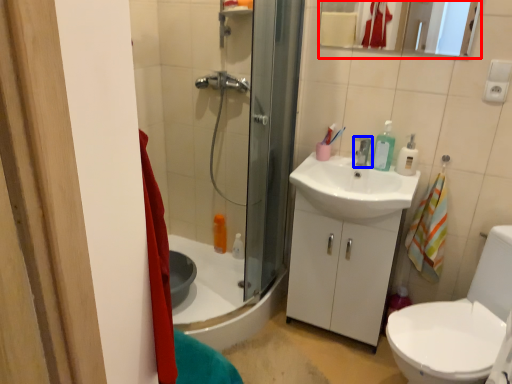
Question: Which object appears farthest to the camera in this image, mirror (highlighted by a red box) or tap (highlighted by a blue box)?

Choices:
 (A) mirror
 (B) tap

Answer: (B)